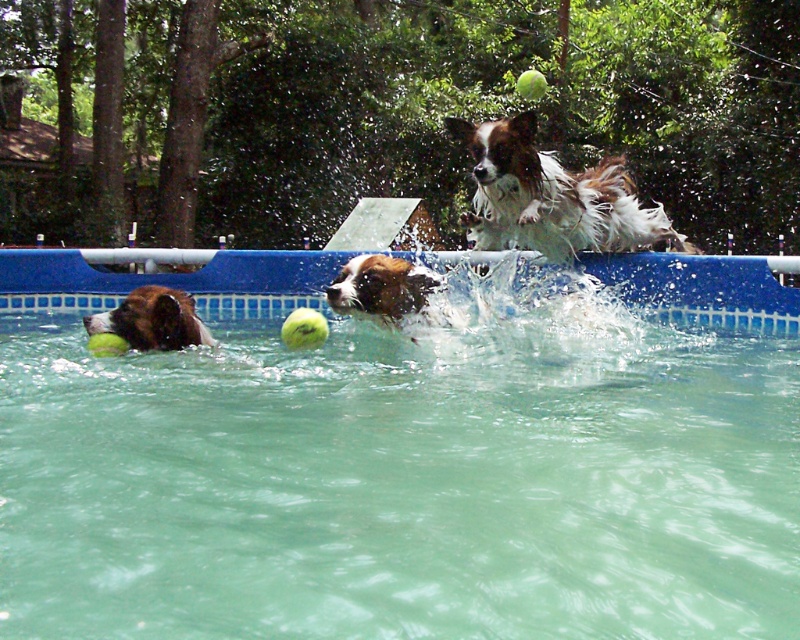
Question: Among these objects, which one is nearest to the camera?

Choices:
 (A) white and brown fur dog at upper center
 (B) white and brown fur dog at center

Answer: (B)

Question: Can you confirm if blue plastic swimming pool at center is smaller than brown and white fur dog at left?

Choices:
 (A) no
 (B) yes

Answer: (A)

Question: Is white and brown fur dog at center positioned at the back of brown and white fur dog at left?

Choices:
 (A) no
 (B) yes

Answer: (B)

Question: Is blue plastic swimming pool at center closer to the viewer compared to brown and white fur dog at left?

Choices:
 (A) yes
 (B) no

Answer: (A)

Question: Which point appears farthest from the camera in this image?

Choices:
 (A) (374, 276)
 (B) (106, 316)
 (C) (620, 227)
 (D) (172, 557)

Answer: (C)

Question: Which of the following is the farthest from the observer?

Choices:
 (A) (136, 300)
 (B) (500, 636)

Answer: (A)